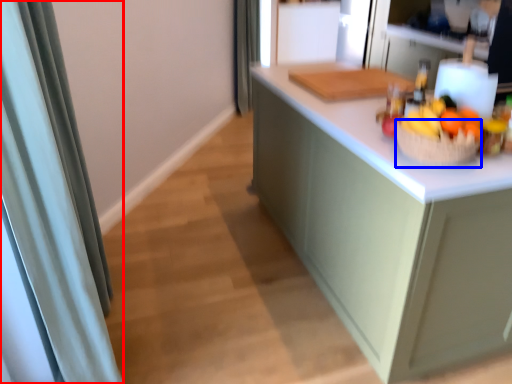
Question: Among these objects, which one is nearest to the camera, shower curtain (highlighted by a red box) or basket (highlighted by a blue box)?

Choices:
 (A) shower curtain
 (B) basket

Answer: (A)